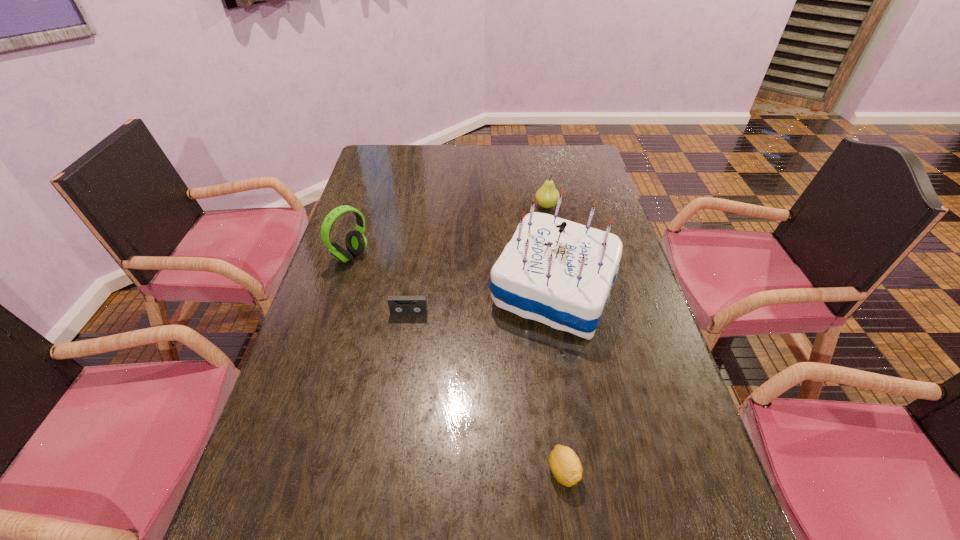
I want to click on birthday cake, so click(x=560, y=273).

This screenshot has height=540, width=960. Identify the location of the leftmost object. (356, 243).

The image size is (960, 540). I want to click on headset, so click(356, 243).

The height and width of the screenshot is (540, 960). Identify the location of the third tallest object. (547, 196).

Identify the location of the farthest object. This screenshot has height=540, width=960. (547, 196).

Identify the location of the fifth object from right to left. (398, 305).

This screenshot has height=540, width=960. Find the location of `the second nearest object`. the second nearest object is located at coordinates [x=565, y=465].

I want to click on vacant space located 0.180m on the front of the tallest object, so click(573, 410).

What are the coordinates of `vacant point located on the back of the second tallest object` in the screenshot? It's located at (368, 201).

Find the location of a particular element. vacant space located 0.250m on the left of the fourth shortest object is located at coordinates (462, 206).